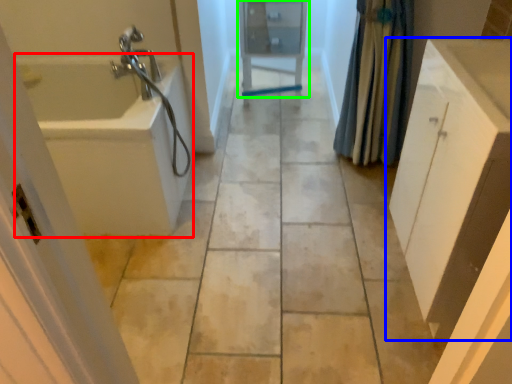
Question: Which object is positioned farthest from bath (highlighted by a red box)? Select from bathroom cabinet (highlighted by a blue box) and medicine cabinet (highlighted by a green box).

Choices:
 (A) bathroom cabinet
 (B) medicine cabinet

Answer: (A)